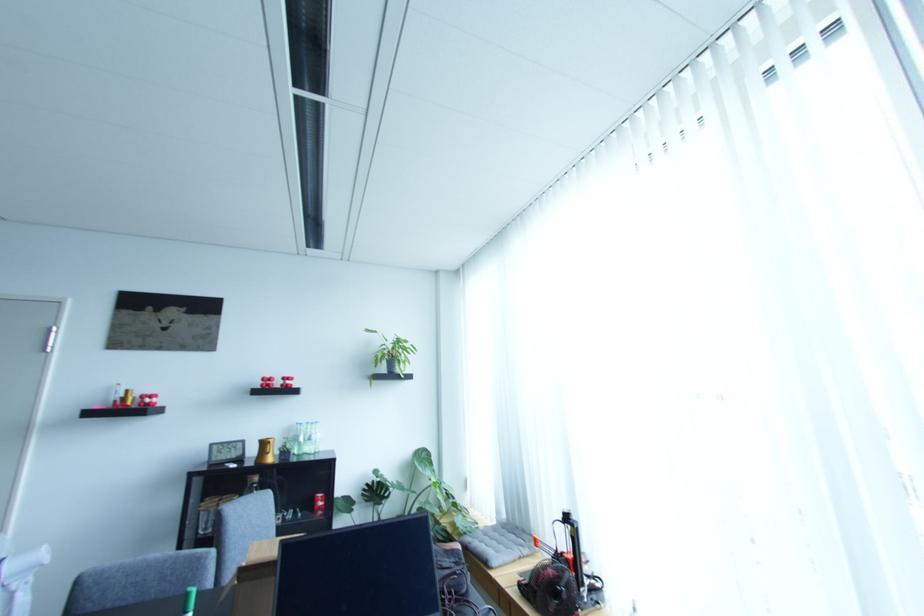
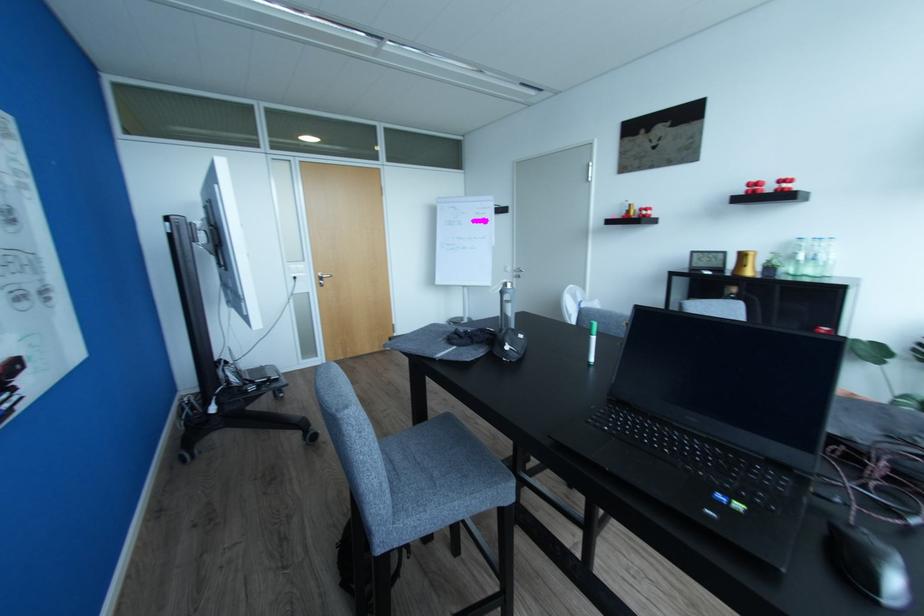
Find the pixel in the second image that matches (x=273, y=377) in the first image.

(760, 180)